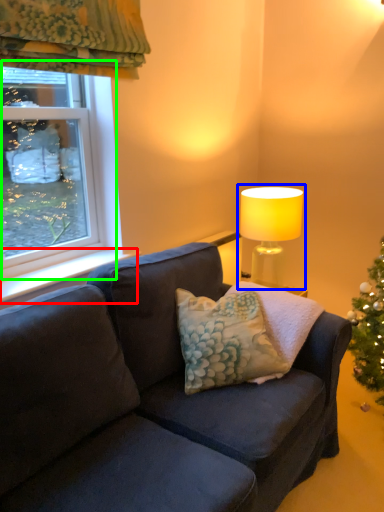
Question: Which object is positioned closest to window sill (highlighted by a red box)? Select from lamp (highlighted by a blue box) and window (highlighted by a green box).

Choices:
 (A) lamp
 (B) window

Answer: (B)